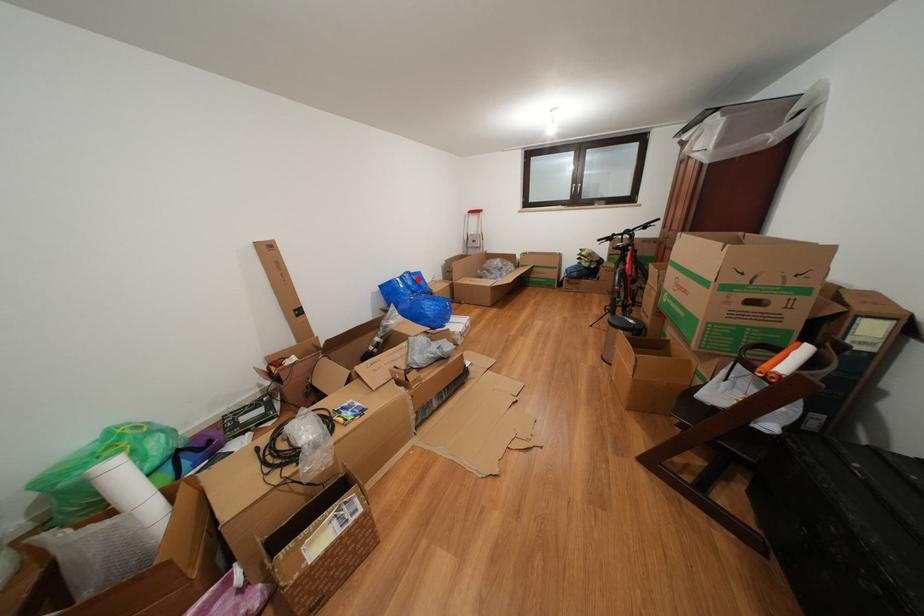
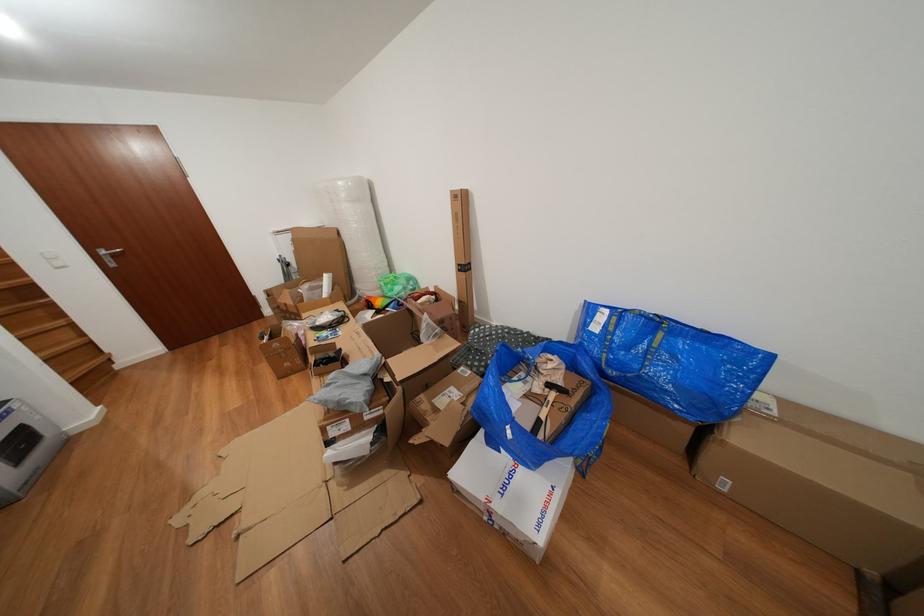
Locate, in the second image, the point that corresponds to the highlighted location in the first image.

(663, 328)